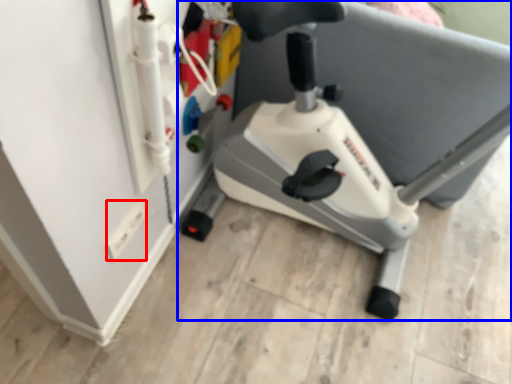
Question: Among these objects, which one is farthest to the camera, electric outlet (highlighted by a red box) or stationary bicycle (highlighted by a blue box)?

Choices:
 (A) electric outlet
 (B) stationary bicycle

Answer: (A)